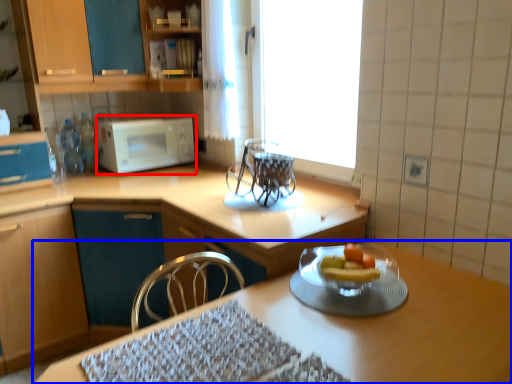
Question: Which point is further to the camera, microwave oven (highlighted by a red box) or table (highlighted by a blue box)?

Choices:
 (A) microwave oven
 (B) table

Answer: (A)